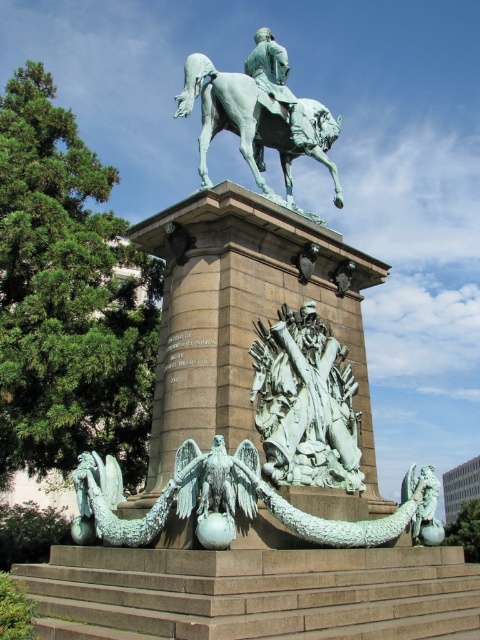
Does green patina statue at center have a greater width compared to green patina statue at upper center?

Yes, green patina statue at center is wider than green patina statue at upper center.

Who is more distant from viewer, (x=108, y=524) or (x=269, y=45)?

Point (x=269, y=45)

This screenshot has width=480, height=640. In order to click on green patina statue at center in this screenshot , I will do `click(256, 349)`.

Does green patina statue at center have a smaller size compared to bronze textured sculpture at center?

No, green patina statue at center is not smaller than bronze textured sculpture at center.

Is point (86, 513) behind point (339, 438)?

No, it is in front of (339, 438).

The width and height of the screenshot is (480, 640). I want to click on green patina statue at center, so click(256, 349).

Which of these two, bronze textured sculpture at center or green patina statue at upper center, stands taller?

green patina statue at upper center is taller.

Does bronze textured sculpture at center appear on the left side of green patina statue at upper center?

In fact, bronze textured sculpture at center is to the right of green patina statue at upper center.

You are a GUI agent. You are given a task and a screenshot of the screen. Output one action in this format:
    pyautogui.click(x=<x>, y=<y>)
    Task: Click on the bronze textured sculpture at center
    The image size is (480, 640).
    Given the screenshot: What is the action you would take?
    pyautogui.click(x=304, y=403)

At what (x,y) coordinates should I click in order to perform the action: click on bronze textured sculpture at center. Please return your answer as a coordinate pair (x, y). The width and height of the screenshot is (480, 640). Looking at the image, I should click on (304, 403).